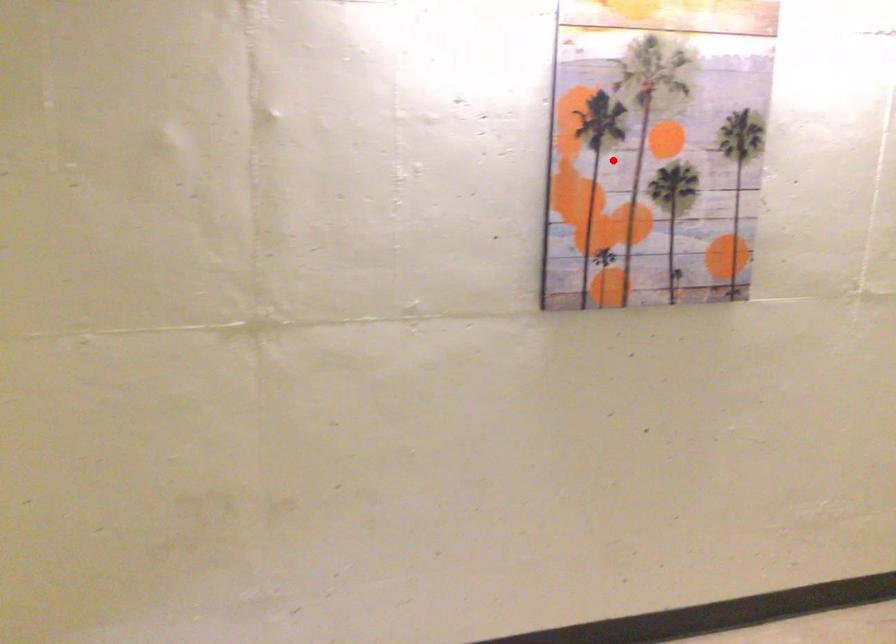
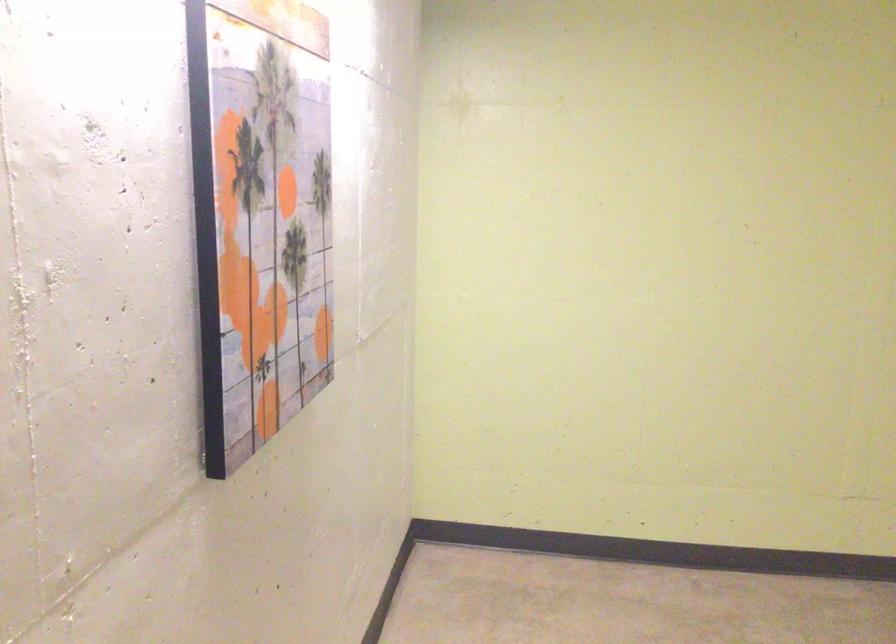
Question: I am providing you with two images of the same scene from different viewpoints. In image1, a red point is highlighted. Considering the same 3D point in image2, which of the following is correct?

Choices:
 (A) It is closer
 (B) It is farther

Answer: (A)